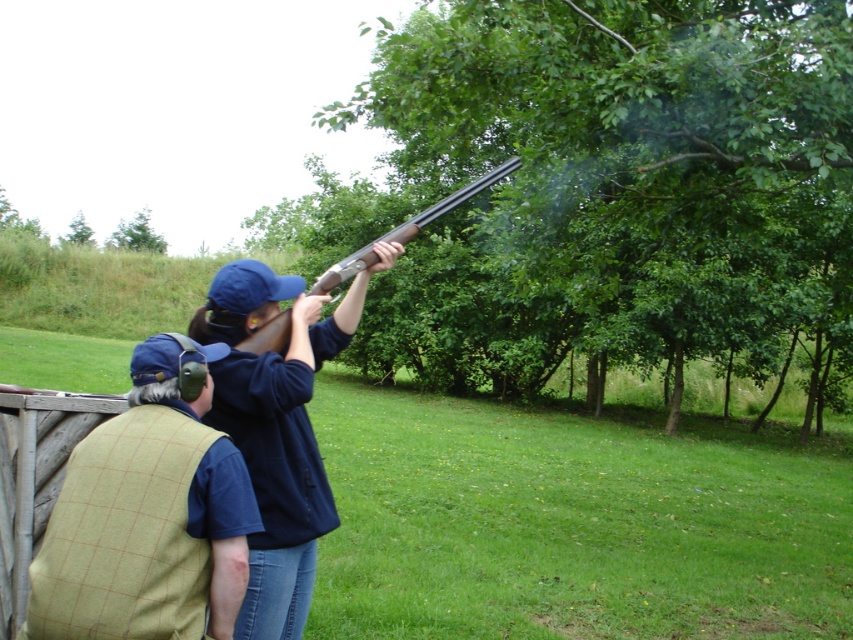
Does blue fabric shirt at upper center have a larger size compared to brown wooden shotgun at upper center?

Actually, blue fabric shirt at upper center might be smaller than brown wooden shotgun at upper center.

Is blue fabric shirt at upper center shorter than brown wooden shotgun at upper center?

Yes.

Is point (322, 486) closer to viewer compared to point (347, 275)?

Yes, it is in front of point (347, 275).

Where is `blue fabric shirt at upper center`? The image size is (853, 640). blue fabric shirt at upper center is located at coordinates (277, 428).

Which is more to the right, green tweed vest at center or blue fabric shirt at upper center?

blue fabric shirt at upper center is more to the right.

Which of these two, green tweed vest at center or blue fabric shirt at upper center, stands shorter?

Standing shorter between the two is green tweed vest at center.

Measure the distance between green tweed vest at center and camera.

The distance of green tweed vest at center from camera is 2.23 meters.

At what (x,y) coordinates should I click in order to perform the action: click on green tweed vest at center. Please return your answer as a coordinate pair (x, y). The width and height of the screenshot is (853, 640). Looking at the image, I should click on (148, 515).

Between green tweed vest at center and brown wooden shotgun at upper center, which one appears on the left side from the viewer's perspective?

Positioned to the left is green tweed vest at center.

Who is more forward, (131, 586) or (451, 204)?

Point (131, 586) is in front.

At what (x,y) coordinates should I click in order to perform the action: click on green tweed vest at center. Please return your answer as a coordinate pair (x, y). This screenshot has height=640, width=853. Looking at the image, I should click on (148, 515).